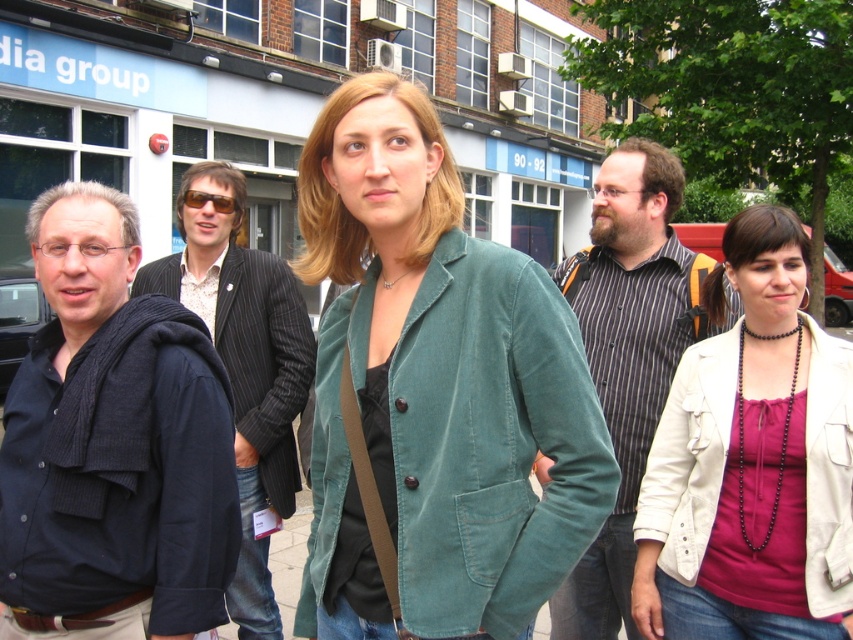
You are a fashion designer observing the scene. Which clothing item, the black pinstripe suit at center or the white leather jacket at lower right, would you recommend for someone who prefers a more formal look?

The black pinstripe suit at center is bigger than the white leather jacket at lower right, making it a more formal option.

You are standing at the point marked by the coordinates point (120, 472) in the image. What object is located at that point?

The point (120, 472) corresponds to the dark blue corduroy jacket at left.

You are a fashion designer observing the two men in the image wearing the striped cotton shirt at center and the black pinstripe suit at center. Which of their outfits appears narrower?

The striped cotton shirt at center appears narrower than the black pinstripe suit at center because its width is less than the suit.